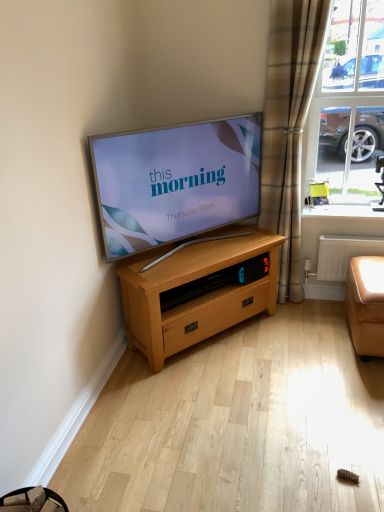
The image size is (384, 512). What are the coordinates of `free space in front of tan leather armchair at right` in the screenshot? It's located at (335, 209).